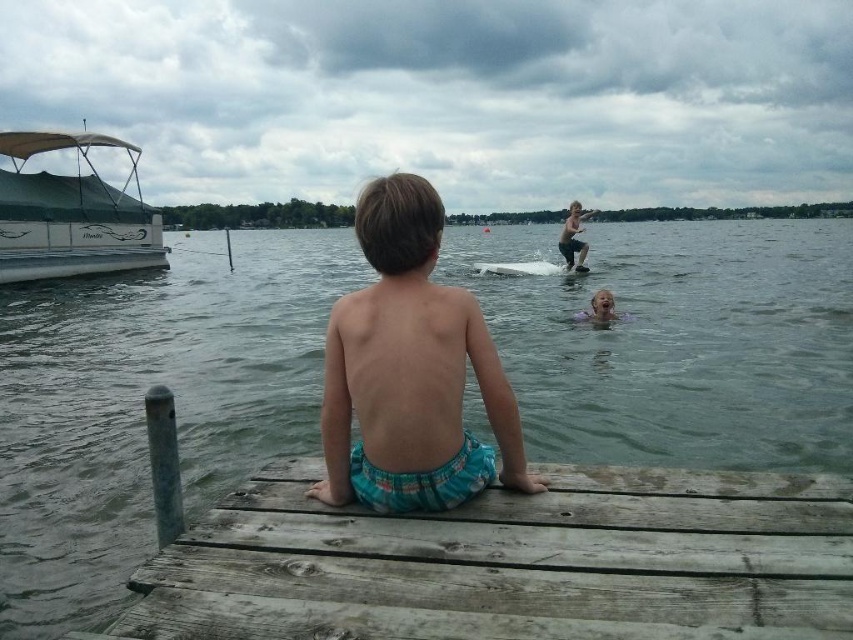
Question: Is the position of clear water at center less distant than that of turquoise printed shorts at center?

Choices:
 (A) yes
 (B) no

Answer: (B)

Question: Which of these objects is positioned farthest from the weathered wood dock at center?

Choices:
 (A) white matte boat at upper left
 (B) clear water at center
 (C) smooth skin person at upper center
 (D) turquoise printed shorts at center

Answer: (A)

Question: Among these points, which one is farthest from the camera?

Choices:
 (A) (117, 147)
 (B) (575, 557)
 (C) (300, 420)
 (D) (407, 301)

Answer: (A)

Question: Where is turquoise printed shorts at center located in relation to smooth skin person at upper center in the image?

Choices:
 (A) right
 (B) left

Answer: (B)

Question: Which point appears farthest from the camera in this image?

Choices:
 (A) (756, 417)
 (B) (566, 257)
 (C) (329, 540)

Answer: (B)

Question: Can you confirm if turquoise printed shorts at center is wider than white matte boat at upper left?

Choices:
 (A) no
 (B) yes

Answer: (A)